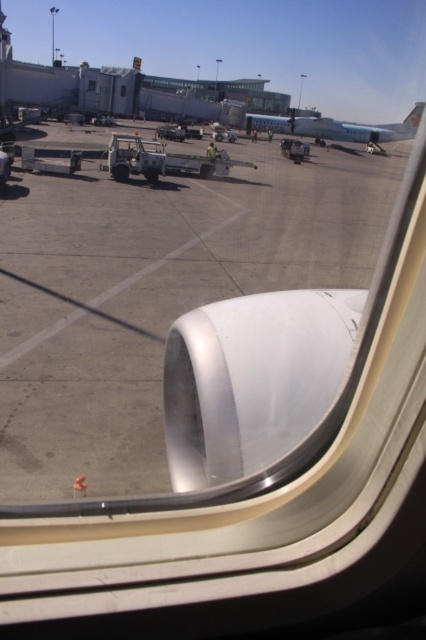
Question: Among these points, which one is nearest to the camera?

Choices:
 (A) click(x=342, y=125)
 (B) click(x=94, y=90)

Answer: (B)

Question: Which of the following is the closest to the observer?

Choices:
 (A) white matte airplane at upper center
 (B) transparent glass window at center

Answer: (B)

Question: Can you confirm if white matte airplane at upper center is positioned to the left of transparent glass window at center?

Choices:
 (A) yes
 (B) no

Answer: (B)

Question: Is white matte airplane at upper center positioned before transparent glass window at center?

Choices:
 (A) yes
 (B) no

Answer: (B)

Question: Is white matte airplane at upper center to the right of transparent glass window at center from the viewer's perspective?

Choices:
 (A) no
 (B) yes

Answer: (B)